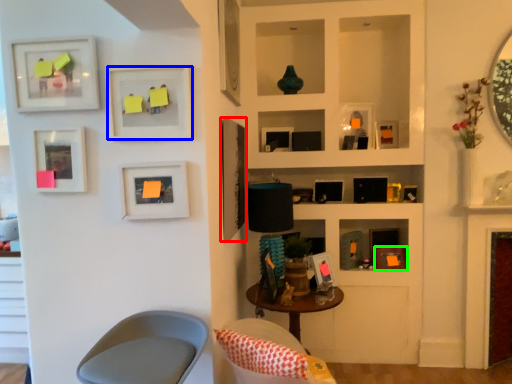
Question: Estimate the real-world distances between objects in this image. Which object is closer to picture frame (highlighted by a red box), picture frame (highlighted by a blue box) or picture frame (highlighted by a green box)?

Choices:
 (A) picture frame
 (B) picture frame

Answer: (A)